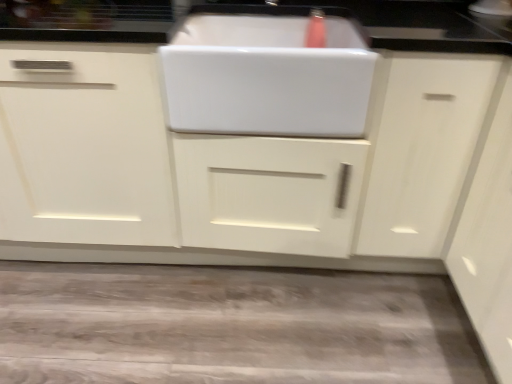
The image size is (512, 384). Identify the location of white glossy sink at center. (266, 73).

Describe the element at coordinates (266, 73) in the screenshot. This screenshot has width=512, height=384. I see `white glossy sink at center` at that location.

Find the location of a particular element. This screenshot has height=384, width=512. white glossy sink at center is located at coordinates (266, 73).